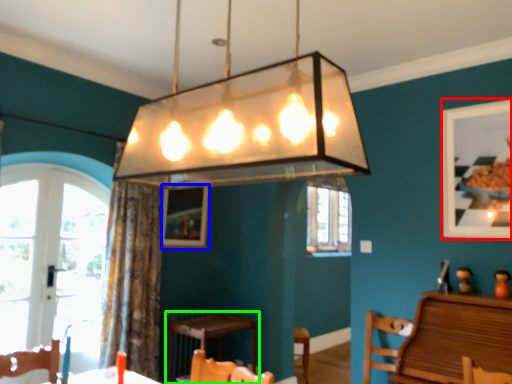
Question: Considering the real-world distances, which object is farthest from picture frame (highlighted by a red box)? picture frame (highlighted by a blue box) or table (highlighted by a green box)?

Choices:
 (A) picture frame
 (B) table

Answer: (A)